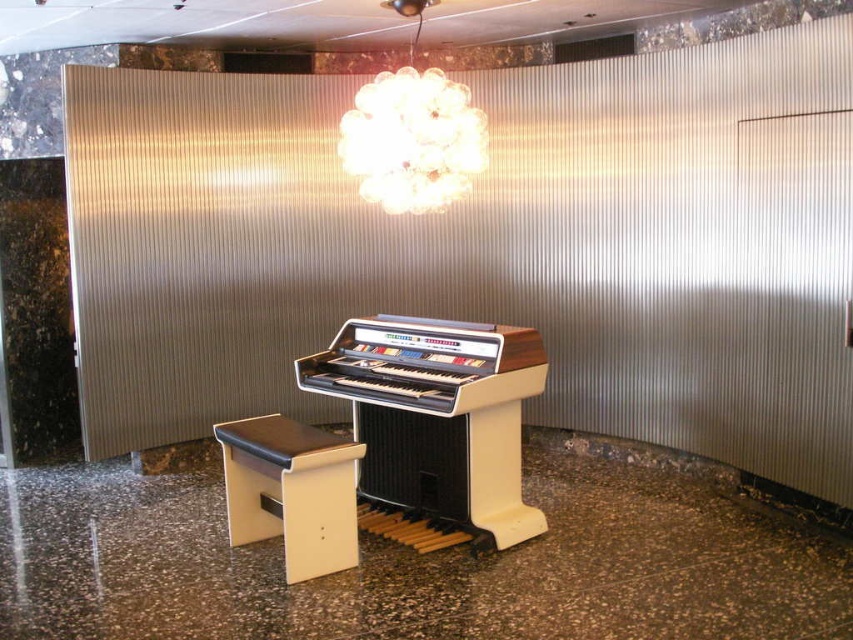
Question: Among these points, which one is nearest to the camera?

Choices:
 (A) (363, 96)
 (B) (352, 486)
 (C) (383, 444)

Answer: (B)

Question: Which of these objects is positioned farthest from the translucent glass globe at upper center?

Choices:
 (A) beige leather music stool at center
 (B) white plastic organ at center

Answer: (A)

Question: Among these points, which one is nearest to the camera?

Choices:
 (A) (401, 124)
 (B) (393, 458)
 (C) (351, 456)

Answer: (C)

Question: Is translucent glass globe at upper center thinner than beige leather music stool at center?

Choices:
 (A) yes
 (B) no

Answer: (B)

Question: Can you confirm if white plastic organ at center is bigger than beige leather music stool at center?

Choices:
 (A) no
 (B) yes

Answer: (B)

Question: Is the position of white plastic organ at center less distant than that of beige leather music stool at center?

Choices:
 (A) yes
 (B) no

Answer: (B)